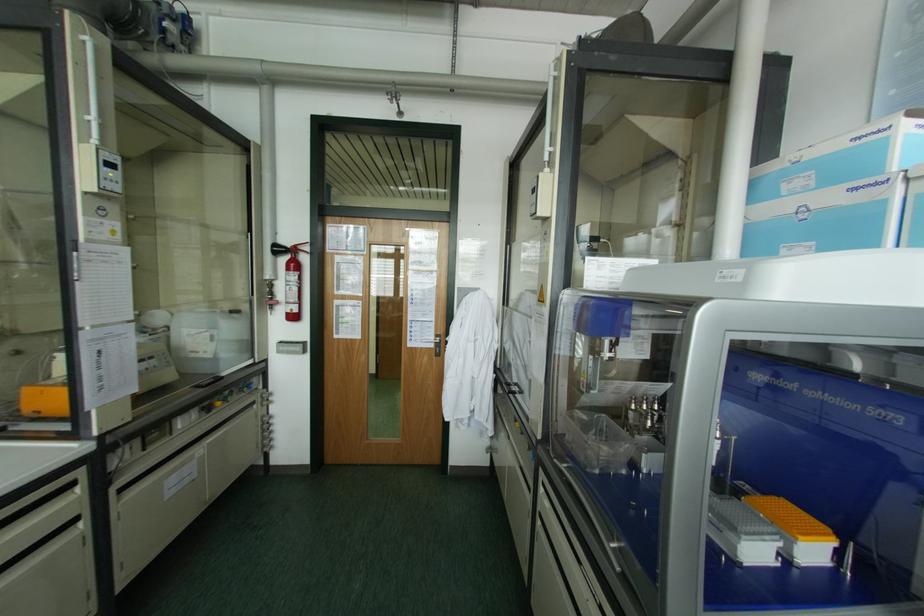
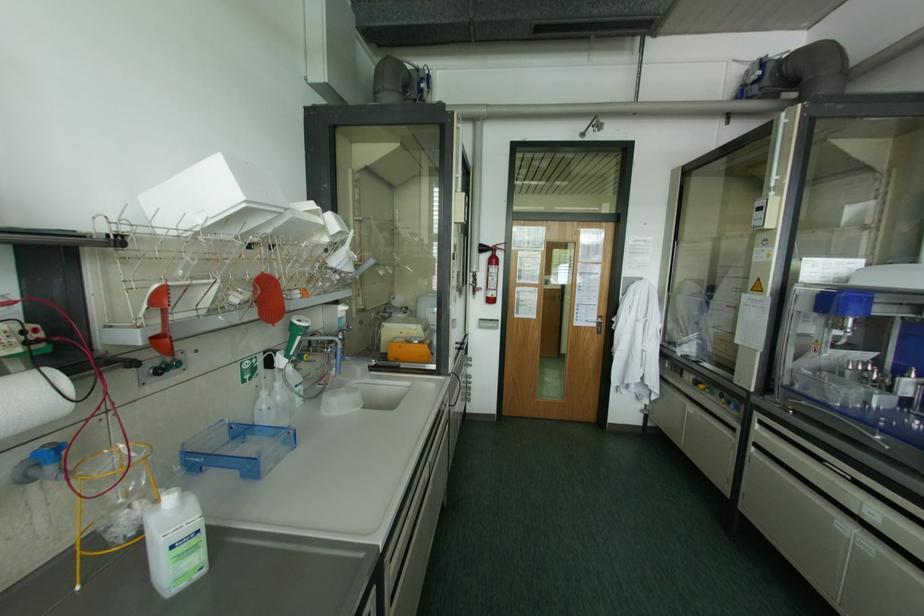
The images are taken continuously from a first-person perspective. In which direction are you moving?

The cameraman moved toward left, backward.